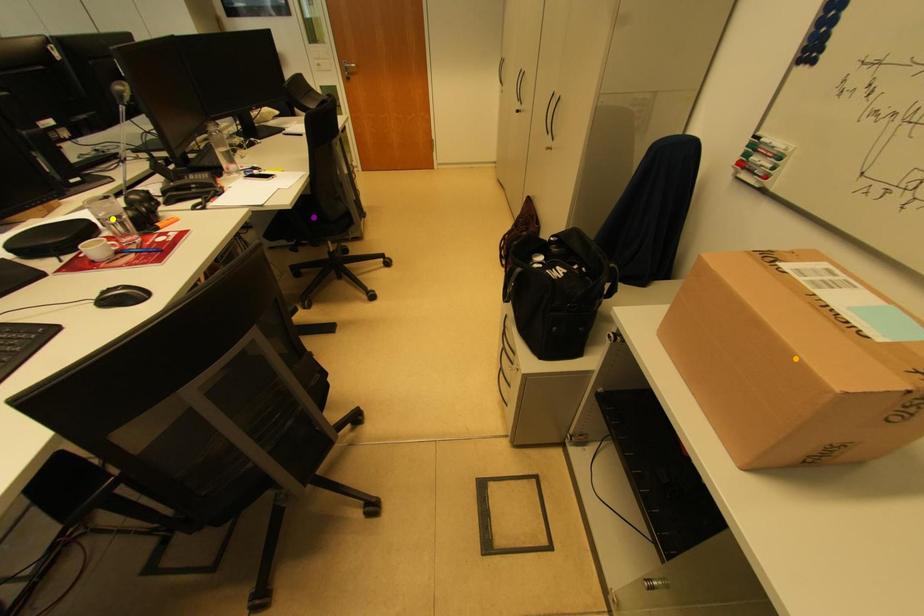
Order these from nearest to farthest:
- purple point
- orange point
- yellow point

1. orange point
2. yellow point
3. purple point